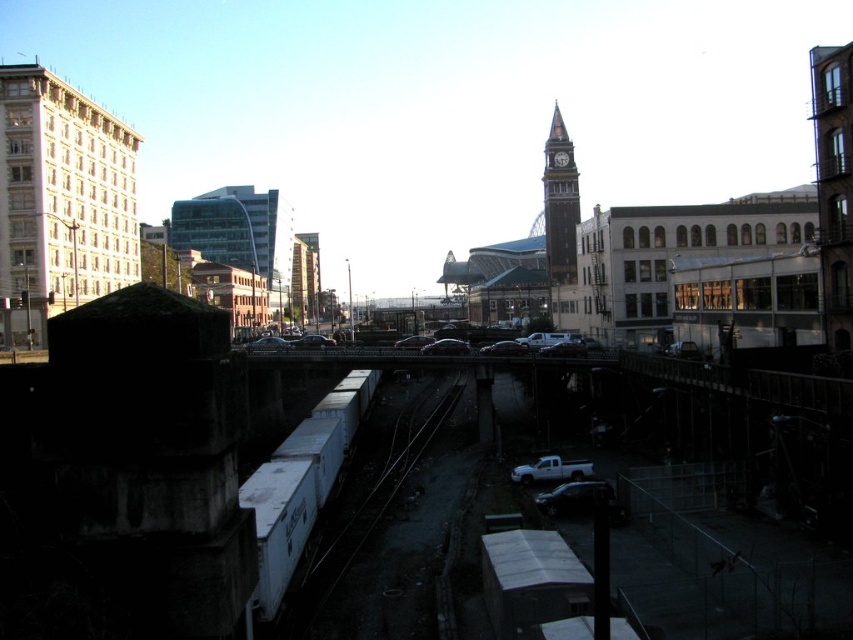
You are a pedestrian standing on the pedestrian bridge and want to walk to the white matte train track at center and the brown stone clock tower at center. Which one is closer to you?

The white matte train track at center is closer to you because it is positioned to the left of the brown stone clock tower at center.

You are a city planner reviewing this urban layout. You need to determine if the white matte train track at center can be extended to reach the brown stone clock tower at center without any obstruction. Based on their relative sizes, is this feasible?

The white matte train track at center is shorter than the brown stone clock tower at center. Since the train track is shorter, it can be extended to reach the clock tower as there is no size obstruction between them.